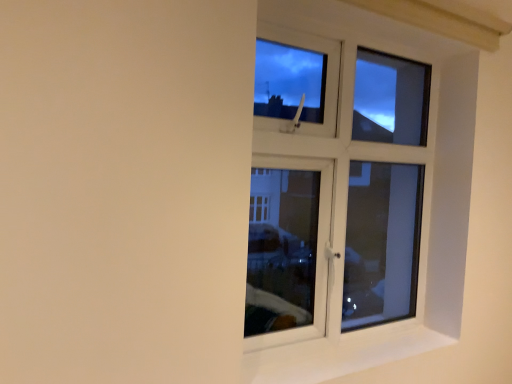
Question: Is white plastic window at upper right thinner than white smooth window sill at right?

Choices:
 (A) no
 (B) yes

Answer: (B)

Question: From a real-world perspective, is white plastic window at upper right on white smooth window sill at right?

Choices:
 (A) no
 (B) yes

Answer: (B)

Question: Can you confirm if white plastic window at upper right is shorter than white smooth window sill at right?

Choices:
 (A) no
 (B) yes

Answer: (A)

Question: Is white plastic window at upper right to the left of white smooth window sill at right from the viewer's perspective?

Choices:
 (A) no
 (B) yes

Answer: (B)

Question: Would you say white plastic window at upper right is a long distance from white smooth window sill at right?

Choices:
 (A) no
 (B) yes

Answer: (B)

Question: Could you tell me if white plastic window at upper right is facing white smooth window sill at right?

Choices:
 (A) no
 (B) yes

Answer: (B)

Question: Would you say white smooth window sill at right is outside white plastic window at upper right?

Choices:
 (A) yes
 (B) no

Answer: (A)

Question: From the image's perspective, is white smooth window sill at right beneath white plastic window at upper right?

Choices:
 (A) no
 (B) yes

Answer: (B)

Question: Is white smooth window sill at right to the right of white plastic window at upper right from the viewer's perspective?

Choices:
 (A) no
 (B) yes

Answer: (B)

Question: From the image's perspective, is white smooth window sill at right located above white plastic window at upper right?

Choices:
 (A) no
 (B) yes

Answer: (A)

Question: From a real-world perspective, is white smooth window sill at right under white plastic window at upper right?

Choices:
 (A) no
 (B) yes

Answer: (B)

Question: Are white smooth window sill at right and white plastic window at upper right far apart?

Choices:
 (A) yes
 (B) no

Answer: (A)

Question: From a real-world perspective, is white plastic window at upper right above or below white smooth window sill at right?

Choices:
 (A) above
 (B) below

Answer: (A)